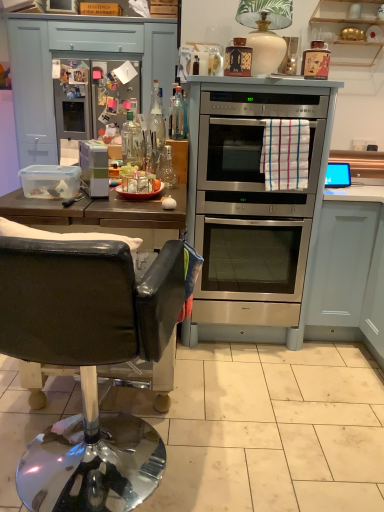
Question: Does matte blue drawer at upper left come in front of wooden shelves at upper right, the first cabinetry from the top?

Choices:
 (A) no
 (B) yes

Answer: (A)

Question: Is matte blue drawer at upper left at the left side of wooden shelves at upper right, the first cabinetry from the top?

Choices:
 (A) no
 (B) yes

Answer: (B)

Question: Would you say matte blue drawer at upper left contains wooden shelves at upper right, which is counted as the 2th cabinetry, starting from the bottom?

Choices:
 (A) no
 (B) yes

Answer: (A)

Question: Is matte blue drawer at upper left positioned far away from wooden shelves at upper right, the first cabinetry from the top?

Choices:
 (A) yes
 (B) no

Answer: (A)

Question: Considering the relative positions of matte blue drawer at upper left and wooden shelves at upper right, which is counted as the 2th cabinetry, starting from the bottom, in the image provided, is matte blue drawer at upper left behind wooden shelves at upper right, which is counted as the 2th cabinetry, starting from the bottom,?

Choices:
 (A) yes
 (B) no

Answer: (A)

Question: From the image's perspective, is white plastic container at left, which ranks as the 1th appliance in front-to-back order, positioned above or below clear glass bottle at center?

Choices:
 (A) above
 (B) below

Answer: (B)

Question: Considering the positions of white plastic container at left, which is the 1th appliance in bottom-to-top order, and clear glass bottle at center in the image, is white plastic container at left, which is the 1th appliance in bottom-to-top order, bigger or smaller than clear glass bottle at center?

Choices:
 (A) big
 (B) small

Answer: (A)

Question: From a real-world perspective, is white plastic container at left, the first appliance positioned from the left, positioned above or below clear glass bottle at center?

Choices:
 (A) below
 (B) above

Answer: (A)

Question: Considering their positions, is white plastic container at left, the first appliance positioned from the left, located in front of or behind clear glass bottle at center?

Choices:
 (A) front
 (B) behind

Answer: (A)

Question: Considering the positions of wooden shelves at upper right, which is counted as the 2th cabinetry, starting from the bottom, and matte black bottle at upper right, the 2th appliance viewed from the right, in the image, is wooden shelves at upper right, which is counted as the 2th cabinetry, starting from the bottom, taller or shorter than matte black bottle at upper right, the 2th appliance viewed from the right,?

Choices:
 (A) short
 (B) tall

Answer: (B)

Question: In the image, is wooden shelves at upper right, which is counted as the 2th cabinetry, starting from the bottom, positioned in front of or behind matte black bottle at upper right, the 2th appliance viewed from the right?

Choices:
 (A) front
 (B) behind

Answer: (B)

Question: Looking at the image, does wooden shelves at upper right, the first cabinetry from the top, seem bigger or smaller compared to matte black bottle at upper right, the 2th appliance viewed from the right?

Choices:
 (A) big
 (B) small

Answer: (A)

Question: Visually, is wooden shelves at upper right, the first cabinetry from the top, positioned to the left or to the right of matte black bottle at upper right, which is counted as the second appliance, starting from the front?

Choices:
 (A) left
 (B) right

Answer: (B)

Question: Is silver metallic oven at center, acting as the second appliance starting from the bottom, in front of or behind stainless steel oven at center in the image?

Choices:
 (A) behind
 (B) front

Answer: (A)

Question: Considering the positions of point (334, 186) and point (231, 138), is point (334, 186) closer or farther from the camera than point (231, 138)?

Choices:
 (A) farther
 (B) closer

Answer: (A)